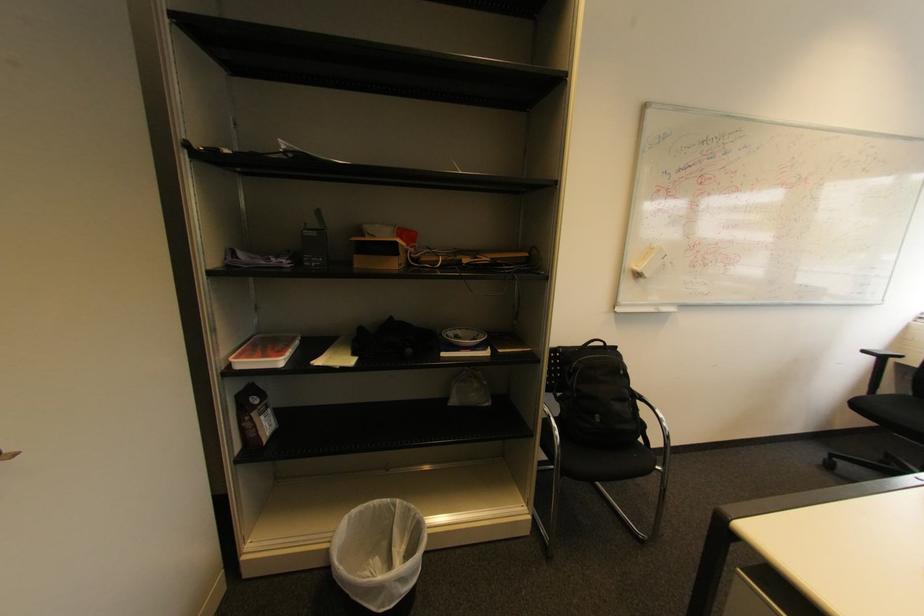
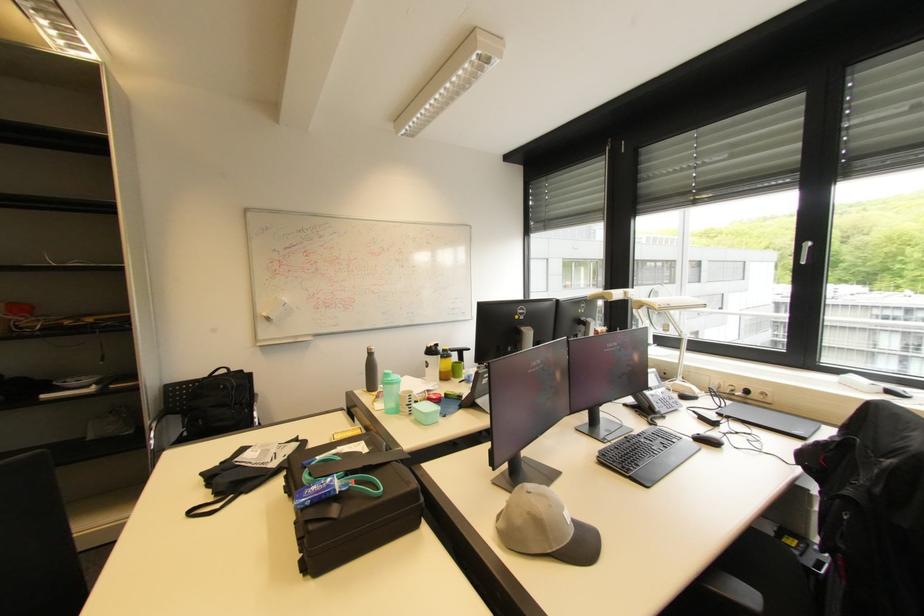
The images are taken continuously from a first-person perspective. In which direction are you moving?

The movement direction of the cameraman is right, backward.